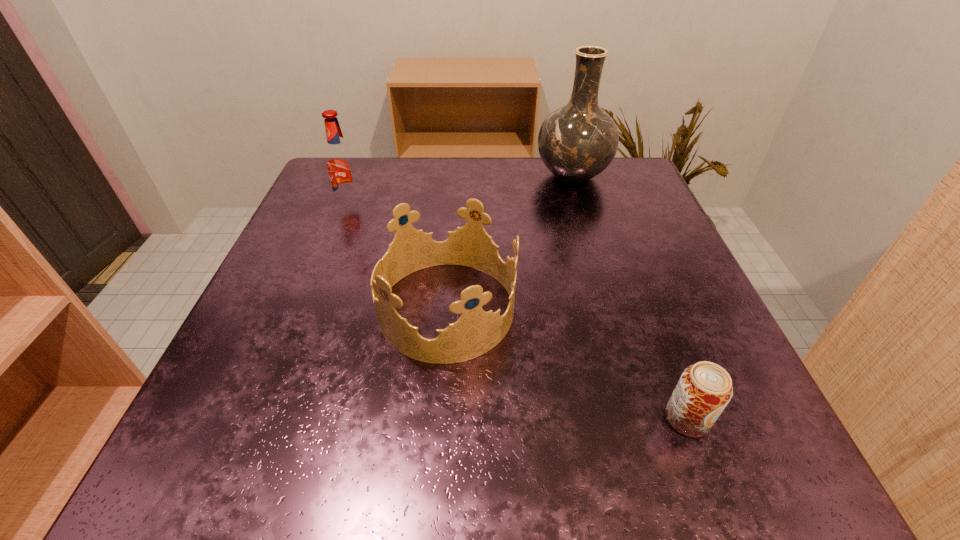
Locate an element on the screen. This screenshot has width=960, height=540. object present at the near right corner is located at coordinates (704, 389).

The height and width of the screenshot is (540, 960). In the image, there is a desktop. What are the coordinates of `vacant area at the far edge` in the screenshot? It's located at (425, 191).

In the image, there is a desktop. Identify the location of blank space at the near edge. This screenshot has width=960, height=540. (406, 433).

This screenshot has width=960, height=540. In order to click on vacant space at the left edge of the desktop in this screenshot , I will do `click(252, 411)`.

Image resolution: width=960 pixels, height=540 pixels. I want to click on free point at the right edge, so click(611, 216).

In the image, there is a desktop. What are the coordinates of `vacant region at the far right corner` in the screenshot? It's located at (603, 185).

At what (x,y) coordinates should I click in order to perform the action: click on free point between the vase and the third nearest object. Please return your answer as a coordinate pair (x, y). This screenshot has height=540, width=960. Looking at the image, I should click on (462, 191).

You are a GUI agent. You are given a task and a screenshot of the screen. Output one action in this format:
    pyautogui.click(x=<x>, y=<y>)
    Task: Click on the free space between the shortest object and the vase
    The width and height of the screenshot is (960, 540).
    Given the screenshot: What is the action you would take?
    pyautogui.click(x=630, y=297)

This screenshot has width=960, height=540. I want to click on empty location between the nearest object and the third shortest object, so click(x=518, y=312).

Find the location of a particular element. empty space that is in between the root beer and the vase is located at coordinates (462, 191).